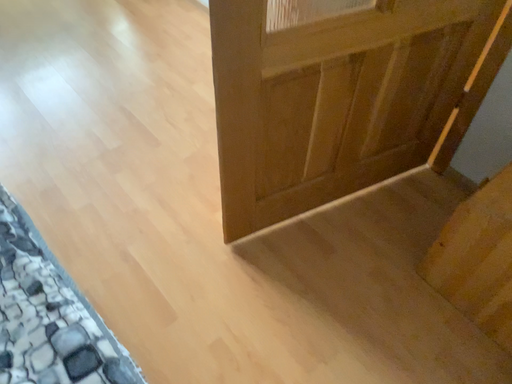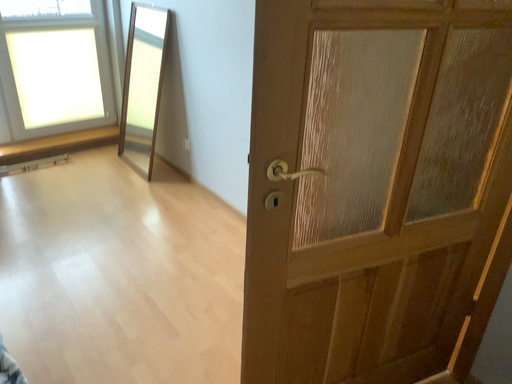
Question: Which way did the camera rotate in the video?

Choices:
 (A) rotated downward
 (B) rotated upward

Answer: (B)